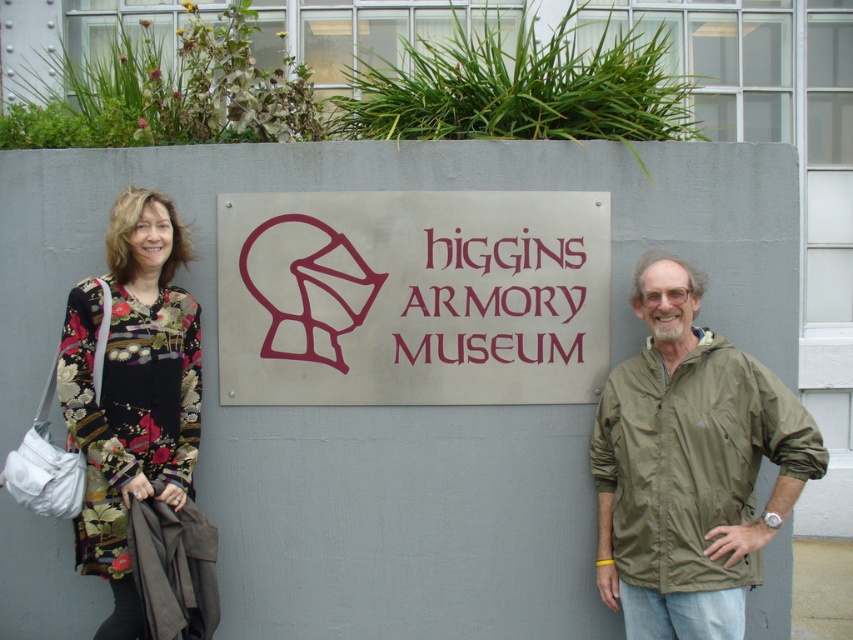
The height and width of the screenshot is (640, 853). In order to click on olive green jacket at right in this screenshot , I will do `click(689, 467)`.

Can you confirm if olive green jacket at right is bigger than floral-patterned fabric dress at left?

Correct, olive green jacket at right is larger in size than floral-patterned fabric dress at left.

What do you see at coordinates (689, 467) in the screenshot? The height and width of the screenshot is (640, 853). I see `olive green jacket at right` at bounding box center [689, 467].

Find the location of a particular element. olive green jacket at right is located at coordinates (689, 467).

Who is shorter, satin silver sign at center or olive green jacket at right?

With less height is satin silver sign at center.

Is point (276, 321) positioned behind point (640, 579)?

Yes, point (276, 321) is behind point (640, 579).

Which is in front, point (341, 298) or point (734, 556)?

Positioned in front is point (734, 556).

This screenshot has width=853, height=640. Find the location of `satin silver sign at center`. satin silver sign at center is located at coordinates (412, 298).

Can you confirm if floral-patterned fabric at left is positioned to the right of satin silver sign at center?

Correct, you'll find floral-patterned fabric at left to the right of satin silver sign at center.

Can you confirm if floral-patterned fabric at left is positioned to the left of satin silver sign at center?

No, floral-patterned fabric at left is not to the left of satin silver sign at center.

You are a GUI agent. You are given a task and a screenshot of the screen. Output one action in this format:
    pyautogui.click(x=<x>, y=<y>)
    Task: Click on the floral-patterned fabric at left
    The height and width of the screenshot is (640, 853).
    Given the screenshot: What is the action you would take?
    (428, 397)